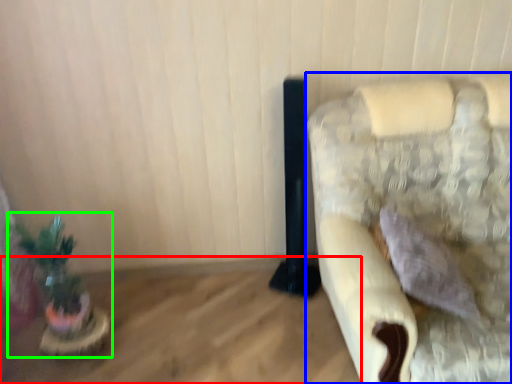
Question: Estimate the real-world distances between objects in this image. Which object is closer to table (highlighted by a red box), furniture (highlighted by a blue box) or houseplant (highlighted by a green box)?

Choices:
 (A) furniture
 (B) houseplant

Answer: (B)